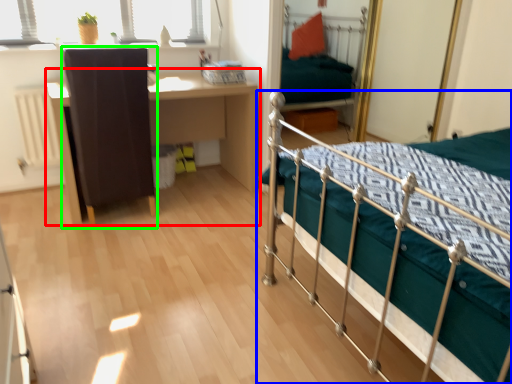
Question: Which object is the farthest from desk (highlighted by a red box)? Choose among these: bed (highlighted by a blue box) or chair (highlighted by a green box).

Choices:
 (A) bed
 (B) chair

Answer: (A)